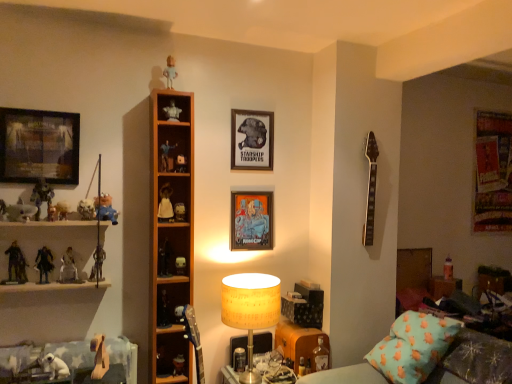
Find the location of `free space underneath metallic figurines at left (from a real-world perspective)`. free space underneath metallic figurines at left (from a real-world perspective) is located at coordinates (57, 336).